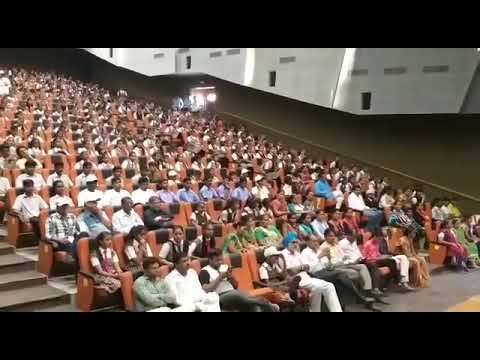
The image size is (480, 360). Identify the location of entry way. (203, 96).